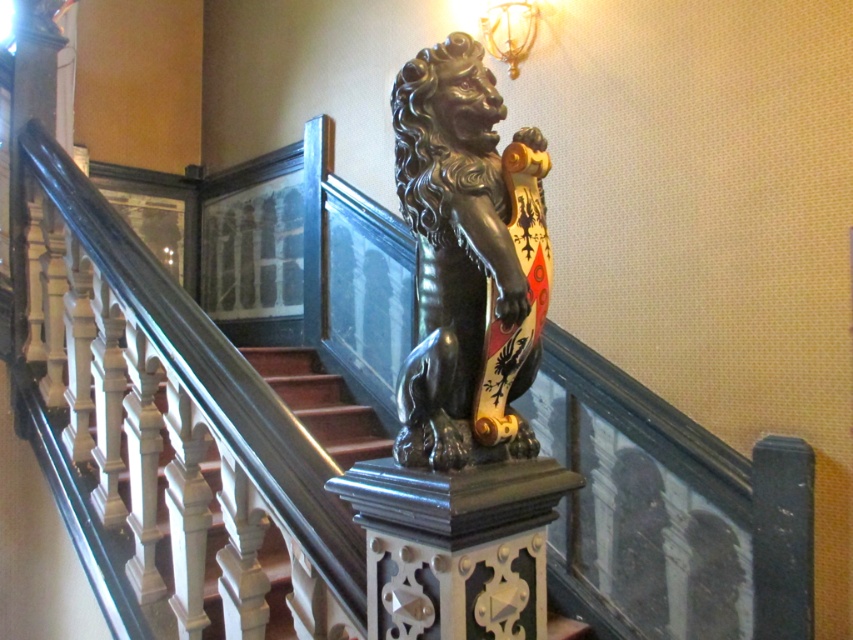
Between point (325, 397) and point (531, 8), which one is positioned behind?

The point (325, 397) is more distant.

Looking at this image, can you confirm if white glossy stair at left is positioned below metallic gold lamp at upper center?

Correct, white glossy stair at left is located below metallic gold lamp at upper center.

Identify the location of white glossy stair at left. Image resolution: width=853 pixels, height=640 pixels. (321, 403).

Is point (485, 173) closer to camera compared to point (318, 365)?

Yes, point (485, 173) is closer to viewer.

Does polished bronze lion at center have a greater height compared to white glossy stair at left?

Correct, polished bronze lion at center is much taller as white glossy stair at left.

Is point (416, 266) positioned before point (204, 580)?

Yes, it is.

At what (x,y) coordinates should I click in order to perform the action: click on polished bronze lion at center. Please return your answer as a coordinate pair (x, y). This screenshot has height=640, width=853. Looking at the image, I should click on (454, 253).

Looking at this image, who is taller, polished bronze lion at center or metallic gold lamp at upper center?

polished bronze lion at center

The image size is (853, 640). What do you see at coordinates (454, 253) in the screenshot?
I see `polished bronze lion at center` at bounding box center [454, 253].

Find the location of `polished bronze lion at center`. polished bronze lion at center is located at coordinates (454, 253).